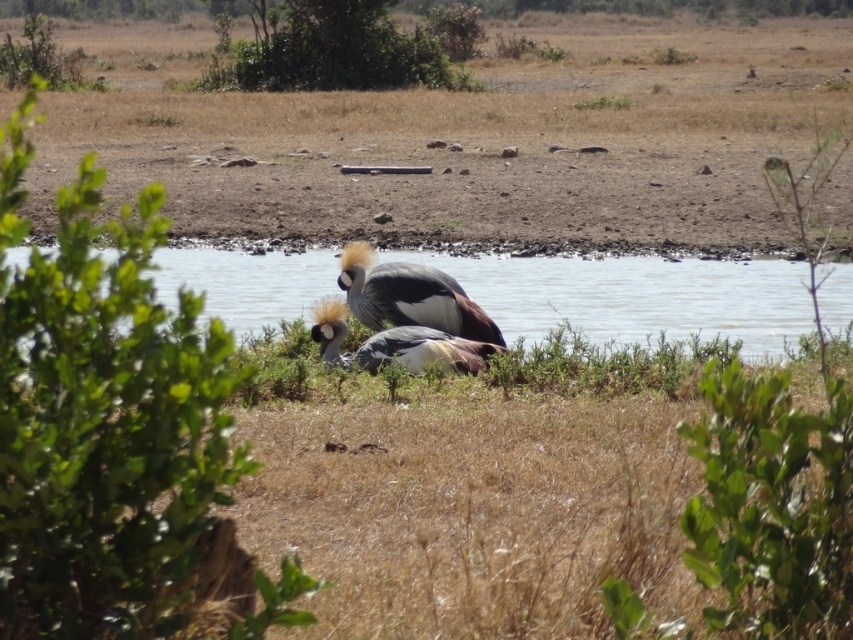
Find the location of a particular element. The width and height of the screenshot is (853, 640). gray matte bird at center is located at coordinates (409, 296).

Does gray matte bird at center have a smaller size compared to gray feathered bird at center?

Yes, gray matte bird at center is smaller than gray feathered bird at center.

Is point (459, 300) behind point (405, 369)?

Yes, it is.

Identify the location of gray matte bird at center. This screenshot has width=853, height=640. (409, 296).

Does clear water at center appear under gray feathered bird at center?

No, clear water at center is not below gray feathered bird at center.

Does clear water at center have a lesser width compared to gray feathered bird at center?

Incorrect, clear water at center's width is not less than gray feathered bird at center's.

Which is in front, point (518, 292) or point (331, 314)?

Point (331, 314) is in front.

In order to click on clear water at center in this screenshot , I will do `click(637, 296)`.

Who is positioned more to the left, clear water at center or gray matte bird at center?

Positioned to the left is gray matte bird at center.

From the picture: Does clear water at center appear over gray matte bird at center?

Actually, clear water at center is below gray matte bird at center.

You are a GUI agent. You are given a task and a screenshot of the screen. Output one action in this format:
    pyautogui.click(x=<x>, y=<y>)
    Task: Click on the clear water at center
    The width and height of the screenshot is (853, 640).
    Given the screenshot: What is the action you would take?
    (x=637, y=296)

The height and width of the screenshot is (640, 853). In order to click on clear water at center in this screenshot , I will do `click(637, 296)`.